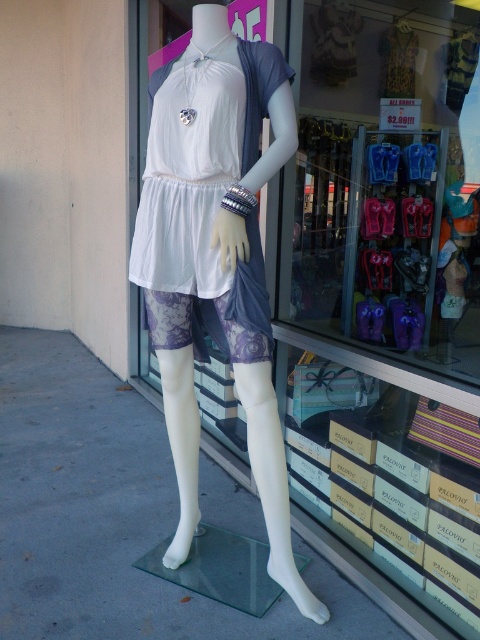
Question: Can you confirm if lace fabric shorts at center is thinner than white matte dress at center?

Choices:
 (A) yes
 (B) no

Answer: (B)

Question: Considering the real-world distances, which object is closest to the white matte dress at center?

Choices:
 (A) lace fabric shorts at center
 (B) purple fabric at center

Answer: (A)

Question: Estimate the real-world distances between objects in this image. Which object is closer to the purple fabric at center?

Choices:
 (A) lace fabric shorts at center
 (B) white matte dress at center

Answer: (B)

Question: Is purple fabric at center thinner than lace fabric shorts at center?

Choices:
 (A) yes
 (B) no

Answer: (B)

Question: Which of the following is the farthest from the observer?

Choices:
 (A) (251, 392)
 (B) (396, 145)
 (C) (236, 278)

Answer: (B)

Question: Can you confirm if lace fabric shorts at center is bigger than white matte dress at center?

Choices:
 (A) yes
 (B) no

Answer: (A)